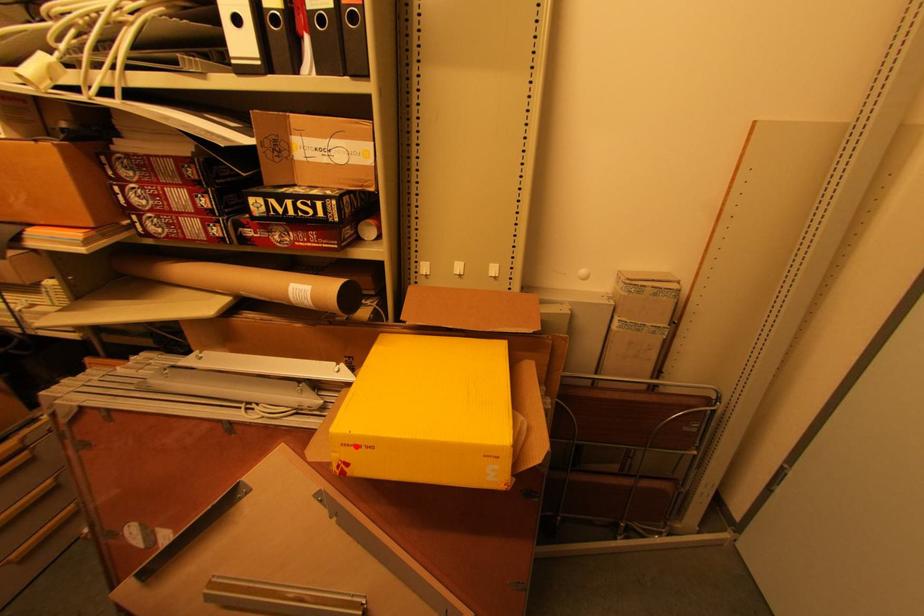
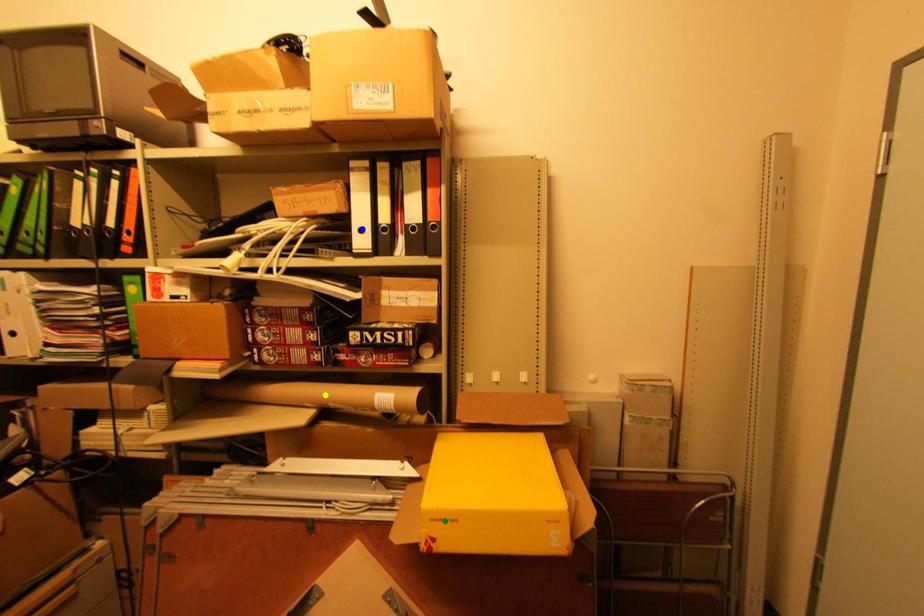
Question: I am providing you with two images of the same scene from different viewpoints. A red point is marked on the first image. You are given multiple points on the second image. In image 2, which mark is for the same physical point as the one in image 1?

Choices:
 (A) yellow point
 (B) blue point
 (C) green point

Answer: (C)